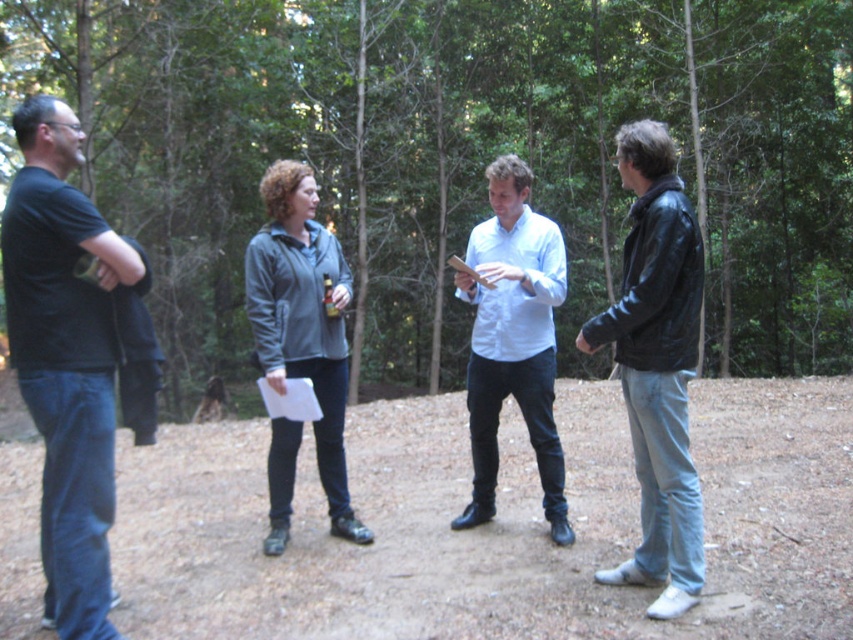
Based on the photo, you are a photographer standing in the forest scene. You need to take a photo of the black leather jacket at right but your camera is 3.96 meters away from it. Can you reach the jacket without moving the camera?

The black leather jacket at right and camera are 3.96 meters apart, so you can reach the jacket by adjusting the camera focus since the distance is within a typical camera range.

You are planning to place a small garden statue that requires a 20 cm tall base. You have two options in the scene, the brown dirt ground at center and the black leather jacket at right. Which location would provide sufficient height for the statue?

The brown dirt ground at center has a greater height compared to the black leather jacket at right, so it would provide sufficient height for the statue.